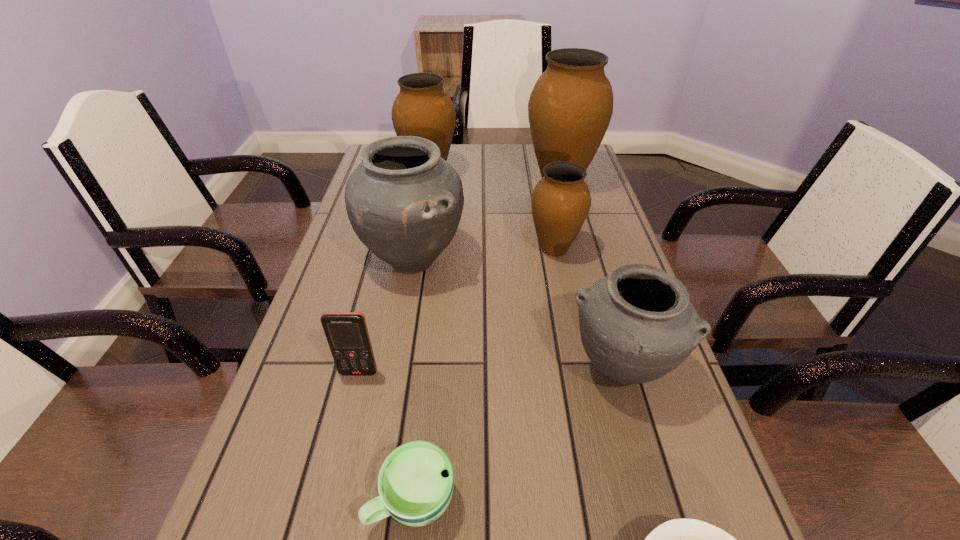
Image resolution: width=960 pixels, height=540 pixels. What are the coordinates of `the seventh tallest object` in the screenshot? It's located at (415, 483).

The image size is (960, 540). Identify the location of blue cup. (415, 483).

Locate an element on the screen. blank area located 0.190m on the front of the tallest urn is located at coordinates (576, 242).

Where is `vacant space located on the front of the second biggest brown urn`? This screenshot has height=540, width=960. vacant space located on the front of the second biggest brown urn is located at coordinates (424, 202).

Locate an element on the screen. The image size is (960, 540). blank space located 0.050m on the left of the bigger black urn is located at coordinates (341, 260).

At what (x,y) coordinates should I click in order to perform the action: click on free space located on the left of the nearest brown urn. Please return your answer as a coordinate pair (x, y). This screenshot has width=960, height=540. Looking at the image, I should click on click(431, 249).

Where is `vacant region located on the back of the nearest urn`? vacant region located on the back of the nearest urn is located at coordinates (602, 307).

This screenshot has width=960, height=540. Find the location of `free spot located 0.140m on the screen of the orange cellular telephone`. free spot located 0.140m on the screen of the orange cellular telephone is located at coordinates (341, 446).

Identify the location of free spot located 0.210m on the back of the cup. (427, 361).

Locate an element on the screen. This screenshot has height=540, width=960. cellular telephone located at the left edge is located at coordinates pos(347,334).